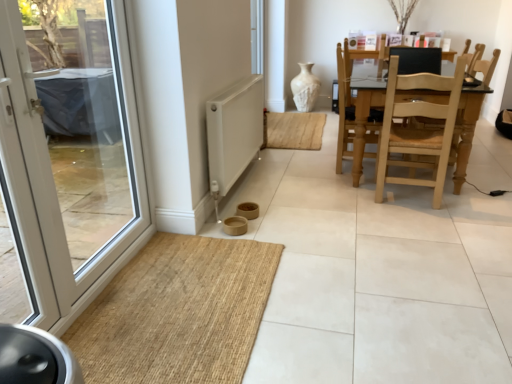
At what (x,y) coordinates should I click in order to perform the action: click on free space to the left of light brown wooden swivel chair at center. Please return your answer as a coordinate pair (x, y). The image size is (512, 384). Looking at the image, I should click on (311, 166).